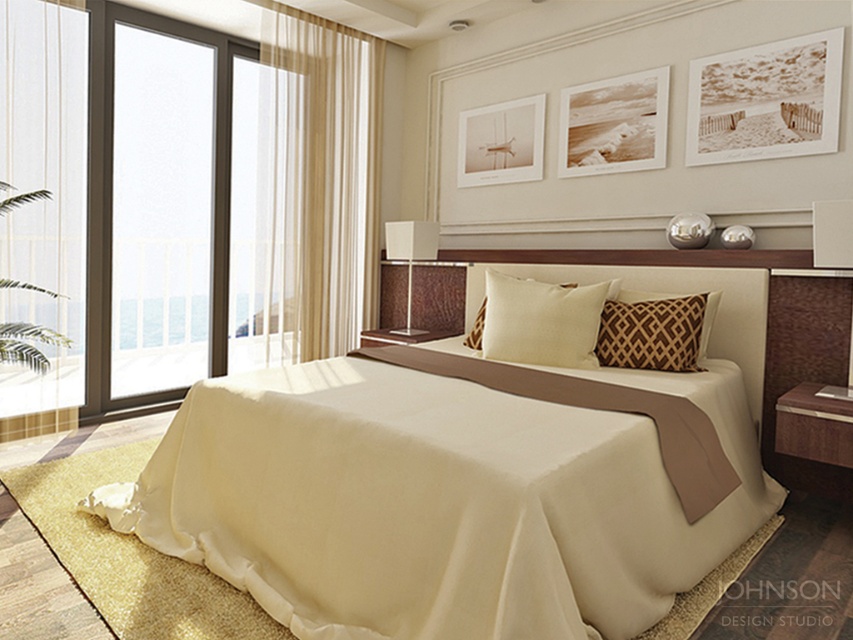
Question: Estimate the real-world distances between objects in this image. Which object is closer to the creamy soft pillow at center?

Choices:
 (A) brown textured pillow at center
 (B) satin beige bed at center
 (C) transparent glass door at left

Answer: (A)

Question: Considering the relative positions of transparent glass door at left and brown textured pillow at center in the image provided, where is transparent glass door at left located with respect to brown textured pillow at center?

Choices:
 (A) left
 (B) right

Answer: (A)

Question: Which of these objects is positioned closest to the transparent glass door at left?

Choices:
 (A) brown textured pillow at center
 (B) satin beige bed at center
 (C) creamy soft pillow at center

Answer: (C)

Question: Is sheer beige curtain at center to the right of transparent glass door at left from the viewer's perspective?

Choices:
 (A) no
 (B) yes

Answer: (B)

Question: Is satin beige bed at center closer to the viewer compared to sheer beige curtain at center?

Choices:
 (A) yes
 (B) no

Answer: (A)

Question: Which object is positioned closest to the brown textured pillow at center?

Choices:
 (A) transparent glass door at left
 (B) sheer beige curtain at center
 (C) satin beige bed at center

Answer: (C)